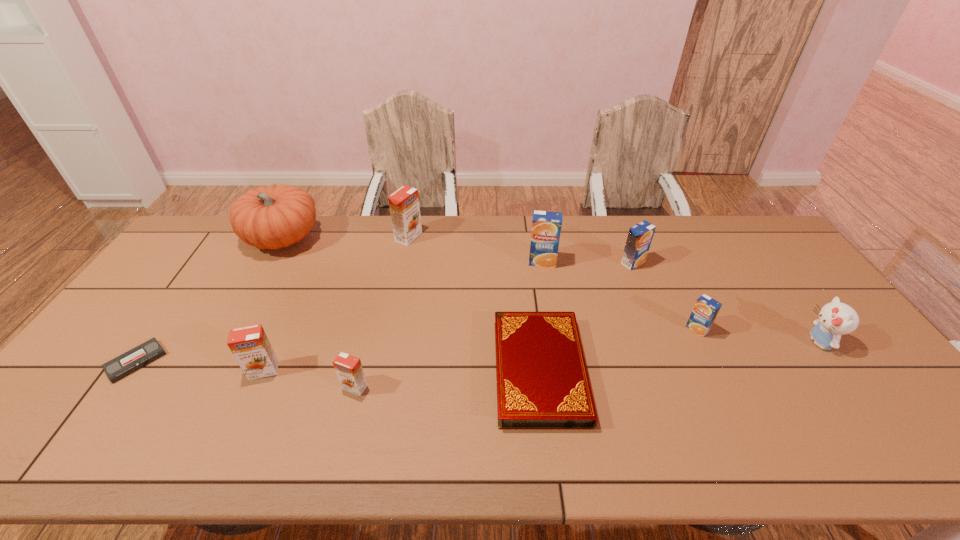
The height and width of the screenshot is (540, 960). In order to click on object at the left edge in this screenshot , I will do `click(129, 362)`.

Where is `object that is at the right edge`? The width and height of the screenshot is (960, 540). object that is at the right edge is located at coordinates (835, 319).

Locate an element on the screen. The height and width of the screenshot is (540, 960). free region at the far edge is located at coordinates (660, 215).

Image resolution: width=960 pixels, height=540 pixels. I want to click on vacant region at the near edge of the desktop, so click(339, 446).

You are a GUI agent. You are given a task and a screenshot of the screen. Output one action in this format:
    pyautogui.click(x=<x>, y=<y>)
    Task: Click on the vacant region at the right edge
    This screenshot has height=540, width=960.
    Given the screenshot: What is the action you would take?
    pyautogui.click(x=893, y=414)

In the image, there is a desktop. Find the location of `free space at the far right corner`. free space at the far right corner is located at coordinates (778, 254).

In the image, there is a desktop. Where is `vacant space at the near right corner`? Image resolution: width=960 pixels, height=540 pixels. vacant space at the near right corner is located at coordinates (877, 449).

Find the location of a particular element. This screenshot has width=960, height=540. blank region between the leftmost object and the biggest blue orange_juice is located at coordinates (339, 312).

Image resolution: width=960 pixels, height=540 pixels. What are the coordinates of `vacant space that's between the videotape and the rightmost object` in the screenshot? It's located at (477, 352).

Where is `free spot between the fifth orange juice from left to right and the biggest orange orange juice`? The image size is (960, 540). free spot between the fifth orange juice from left to right and the biggest orange orange juice is located at coordinates (520, 249).